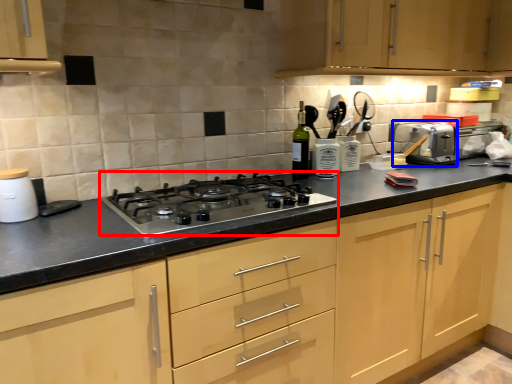
Question: Which of the following is the closest to the observer, gas stove (highlighted by a red box) or toaster (highlighted by a blue box)?

Choices:
 (A) gas stove
 (B) toaster

Answer: (A)